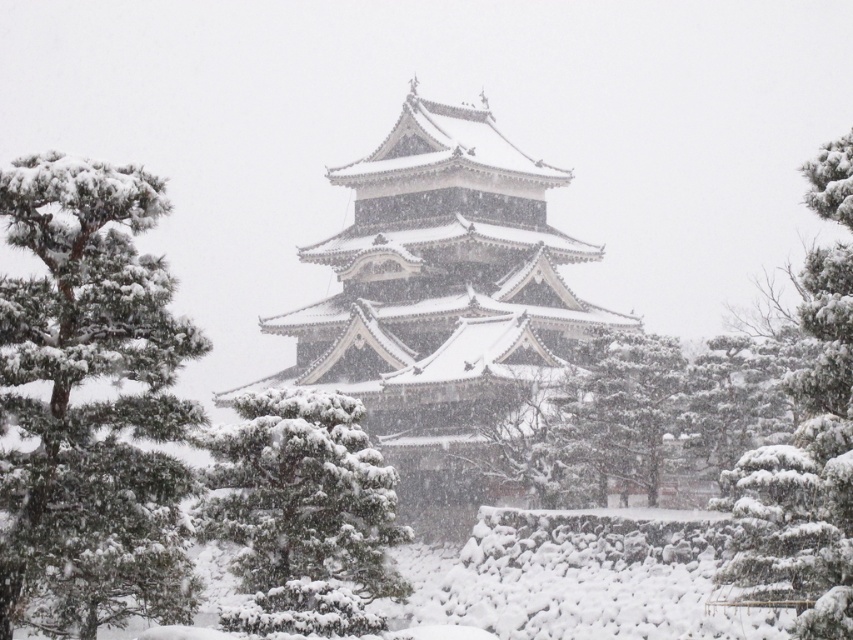
Question: Which of the following is the closest to the observer?

Choices:
 (A) (15, 285)
 (B) (294, 452)

Answer: (A)

Question: Which of the following is the farthest from the observer?

Choices:
 (A) (221, 486)
 (B) (799, 536)
 (C) (194, 422)
 (D) (483, 262)

Answer: (D)

Question: Observing the image, what is the correct spatial positioning of green textured pine at center in reference to snow-covered pine at right?

Choices:
 (A) below
 (B) above

Answer: (A)

Question: Does snow-covered wooden pagoda at center appear on the left side of green matte pine at left?

Choices:
 (A) yes
 (B) no

Answer: (B)

Question: Which object appears farthest from the camera in this image?

Choices:
 (A) snow-covered wooden pagoda at center
 (B) green textured pine at center
 (C) green matte pine at left
 (D) snow-covered pine at right

Answer: (A)

Question: Is snow-covered wooden pagoda at center thinner than green matte pine at left?

Choices:
 (A) no
 (B) yes

Answer: (A)